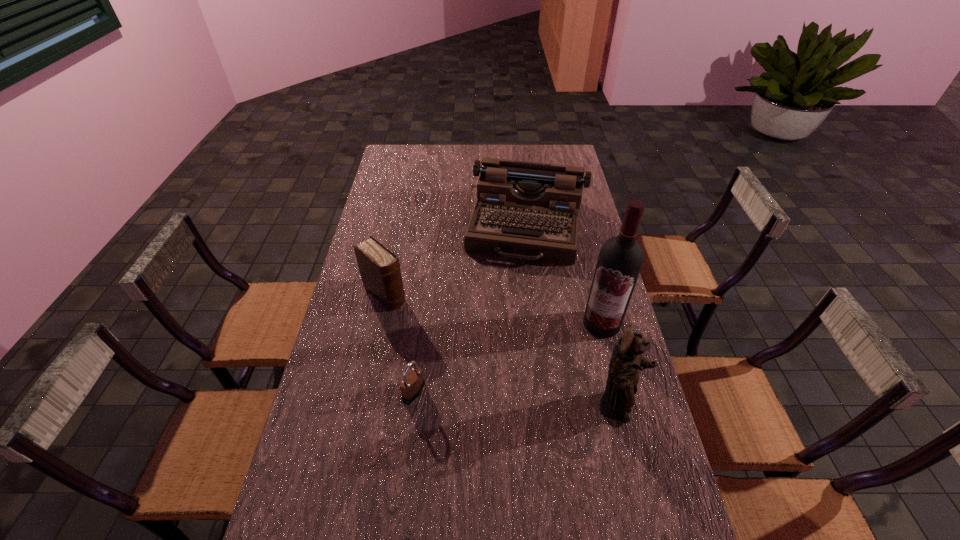
Locate an element on the screen. This screenshot has height=540, width=960. vacant spot on the desktop that is between the fourth object from right to left and the second tallest object and is positioned on the keyboard of the typewriter is located at coordinates (495, 399).

Where is `free space on the desktop that is between the padlock and the figurine and is positioned on the spine side of the diary`? free space on the desktop that is between the padlock and the figurine and is positioned on the spine side of the diary is located at coordinates (502, 399).

The image size is (960, 540). In order to click on free space on the desktop that is between the fourth object from right to left and the figurine and is positioned on the label of the tallest object in this screenshot , I will do `click(522, 401)`.